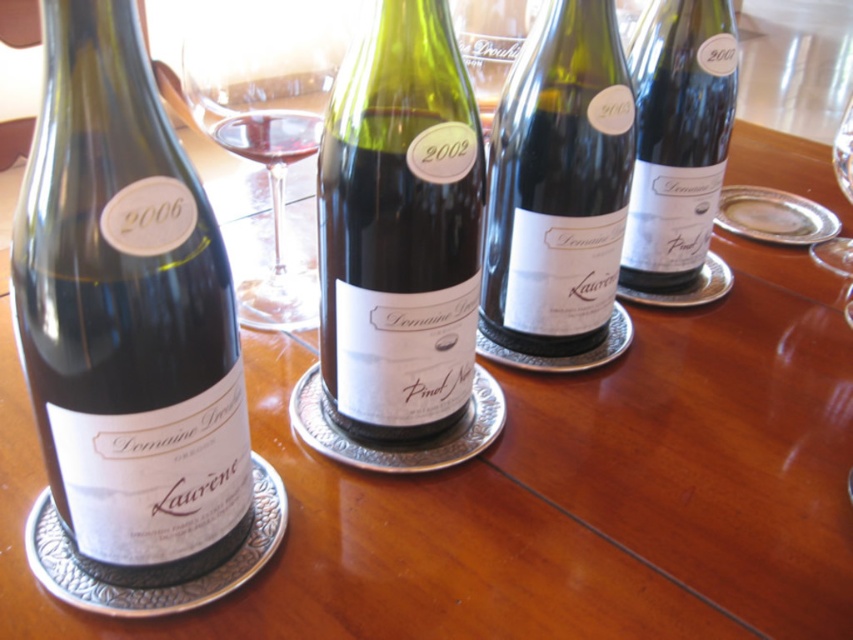
Question: Which point is closer to the camera?

Choices:
 (A) matte glass wine bottle at left
 (B) green glass bottle at center
 (C) transparent glass at center

Answer: (A)

Question: Which object appears closest to the camera in this image?

Choices:
 (A) green glass bottle at center
 (B) transparent glass at center

Answer: (A)

Question: Is the position of transparent glass at center less distant than that of clear glass wine glass at center?

Choices:
 (A) no
 (B) yes

Answer: (B)

Question: Which object is the farthest from the silver metallic platter at center?

Choices:
 (A) matte glass wine bottle at left
 (B) green glass bottle at center
 (C) matte black wine bottle at upper right
 (D) transparent glass at center

Answer: (A)

Question: In this image, where is matte black wine bottle at upper right located relative to clear glass wine glass at center?

Choices:
 (A) left
 (B) right

Answer: (B)

Question: From the image, what is the correct spatial relationship of matte glass wine bottle at left in relation to matte black wine bottle at upper right?

Choices:
 (A) above
 (B) below

Answer: (B)